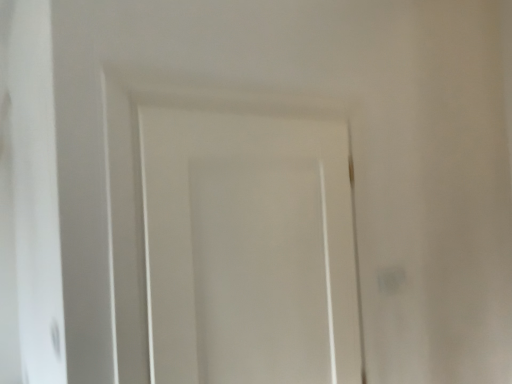
From the picture: What is the approximate width of white matte door at center?

The width of white matte door at center is 3.77 inches.

The image size is (512, 384). Describe the element at coordinates (248, 249) in the screenshot. I see `white matte door at center` at that location.

Identify the location of white matte door at center. The height and width of the screenshot is (384, 512). (248, 249).

In order to click on white matte door at center in this screenshot , I will do `click(248, 249)`.